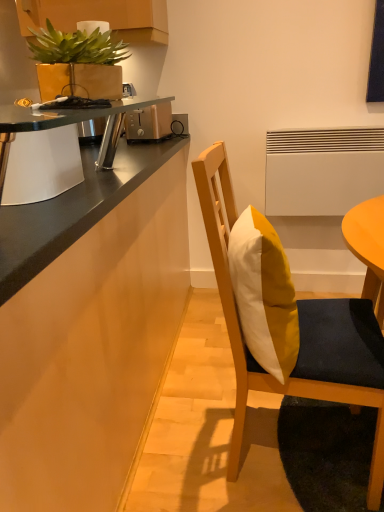
The width and height of the screenshot is (384, 512). Find the location of `metallic silver desk at upper left`. metallic silver desk at upper left is located at coordinates (54, 148).

Image resolution: width=384 pixels, height=512 pixels. Identify the location of yellow matte pillow at center. (264, 294).

Considering the positions of objects matte wood cabinetry at left and metallic silver desk at upper left in the image provided, who is more to the left, matte wood cabinetry at left or metallic silver desk at upper left?

matte wood cabinetry at left.

Between matte wood cabinetry at left and metallic silver desk at upper left, which one has smaller width?

metallic silver desk at upper left is thinner.

Is matte wood cabinetry at left turned away from metallic silver desk at upper left?

No, matte wood cabinetry at left is not facing away from metallic silver desk at upper left.

Can you confirm if matte wood cabinetry at left is shorter than metallic silver desk at upper left?

No, matte wood cabinetry at left is not shorter than metallic silver desk at upper left.

Can you confirm if yellow matte pillow at center is taller than satin gold toaster at upper center?

Yes, yellow matte pillow at center is taller than satin gold toaster at upper center.

Which object is thinner, yellow matte pillow at center or satin gold toaster at upper center?

yellow matte pillow at center is thinner.

From a real-world perspective, is yellow matte pillow at center located higher than satin gold toaster at upper center?

No.

Is wooden chair with cushion at center positioned far away from yellow matte pillow at center?

That's not correct — wooden chair with cushion at center is a little close to yellow matte pillow at center.

From a real-world perspective, is wooden chair with cushion at center on top of yellow matte pillow at center?

Actually, wooden chair with cushion at center is physically below yellow matte pillow at center in the real world.

Considering the relative sizes of wooden chair with cushion at center and yellow matte pillow at center in the image provided, is wooden chair with cushion at center smaller than yellow matte pillow at center?

No.

Is wooden chair with cushion at center thinner than yellow matte pillow at center?

Incorrect, the width of wooden chair with cushion at center is not less than that of yellow matte pillow at center.

Measure the distance between satin gold toaster at upper center and matte gold pot at upper left.

A distance of 33.98 inches exists between satin gold toaster at upper center and matte gold pot at upper left.

From the image's perspective, is satin gold toaster at upper center located above or below matte gold pot at upper left?

satin gold toaster at upper center is above matte gold pot at upper left.

Is satin gold toaster at upper center located outside matte gold pot at upper left?

Absolutely, satin gold toaster at upper center is external to matte gold pot at upper left.

Which of these two, satin gold toaster at upper center or matte gold pot at upper left, is wider?

With larger width is satin gold toaster at upper center.

Locate an element on the screen. chair on the right of matte wood cabinetry at left is located at coordinates (300, 334).

Is matte wood cabinetry at left inside the boundaries of wooden chair with cushion at center, or outside?

matte wood cabinetry at left is spatially situated outside wooden chair with cushion at center.

Considering their positions, is matte wood cabinetry at left located in front of or behind wooden chair with cushion at center?

matte wood cabinetry at left is positioned closer to the viewer than wooden chair with cushion at center.

Is point (151, 358) closer or farther from the camera than point (216, 142)?

Point (151, 358).

How different are the orientations of wooden chair with cushion at center and satin gold toaster at upper center in degrees?

The angle between the facing direction of wooden chair with cushion at center and the facing direction of satin gold toaster at upper center is 89.4 degrees.

Is wooden chair with cushion at center turned away from satin gold toaster at upper center?

No, wooden chair with cushion at center is not facing away from satin gold toaster at upper center.

Does wooden chair with cushion at center appear on the right side of satin gold toaster at upper center?

Yes.

Is wooden chair with cushion at center taller than satin gold toaster at upper center?

Indeed, wooden chair with cushion at center has a greater height compared to satin gold toaster at upper center.

From the image's perspective, which is above, wooden chair with cushion at center or metallic silver desk at upper left?

metallic silver desk at upper left, from the image's perspective.

Considering the sizes of objects wooden chair with cushion at center and metallic silver desk at upper left in the image provided, who is shorter, wooden chair with cushion at center or metallic silver desk at upper left?

Standing shorter between the two is metallic silver desk at upper left.

Is wooden chair with cushion at center facing away from metallic silver desk at upper left?

Correct, wooden chair with cushion at center is looking away from metallic silver desk at upper left.

Looking at this image, between wooden chair with cushion at center and metallic silver desk at upper left, which one has larger size?

wooden chair with cushion at center.

I want to click on desk above the matte wood cabinetry at left (from the image's perspective), so click(54, 148).

Locate an element on the screen. The image size is (384, 512). pillow in front of the satin gold toaster at upper center is located at coordinates (264, 294).

Which object lies nearer to the anchor point wooden chair with cushion at center, metallic silver desk at upper left or matte wood cabinetry at left?

The object closer to wooden chair with cushion at center is matte wood cabinetry at left.

Which object lies further to the anchor point satin gold toaster at upper center, metallic silver desk at upper left or matte gold pot at upper left?

The object further to satin gold toaster at upper center is matte gold pot at upper left.

Estimate the real-world distances between objects in this image. Which object is further from metallic silver desk at upper left, yellow matte pillow at center or satin gold toaster at upper center?

satin gold toaster at upper center is further to metallic silver desk at upper left.

Which object lies nearer to the anchor point matte gold pot at upper left, satin gold toaster at upper center or wooden chair with cushion at center?

wooden chair with cushion at center is positioned closer to the anchor matte gold pot at upper left.

Considering their positions, is satin gold toaster at upper center positioned further to wooden chair with cushion at center than metallic silver desk at upper left?

Based on the image, satin gold toaster at upper center appears to be further to wooden chair with cushion at center.

Based on the photo, estimate the real-world distances between objects in this image. Which object is further from yellow matte pillow at center, metallic silver desk at upper left or matte wood cabinetry at left?

Based on the image, metallic silver desk at upper left appears to be further to yellow matte pillow at center.

Which object lies nearer to the anchor point wooden chair with cushion at center, yellow matte pillow at center or matte wood cabinetry at left?

The object closer to wooden chair with cushion at center is yellow matte pillow at center.

Consider the image. From the image, which object appears to be nearer to matte gold pot at upper left, wooden chair with cushion at center or yellow matte pillow at center?

yellow matte pillow at center is closer to matte gold pot at upper left.

Identify the location of houseplant located between metallic silver desk at upper left and wooden chair with cushion at center in the left-right direction. This screenshot has width=384, height=512. (78, 64).

The width and height of the screenshot is (384, 512). I want to click on houseplant between metallic silver desk at upper left and satin gold toaster at upper center from front to back, so click(x=78, y=64).

Identify the location of houseplant positioned between wooden chair with cushion at center and satin gold toaster at upper center from near to far. This screenshot has width=384, height=512. (78, 64).

The height and width of the screenshot is (512, 384). What are the coordinates of `pillow positioned between matte gold pot at upper left and satin gold toaster at upper center from near to far` in the screenshot? It's located at (264, 294).